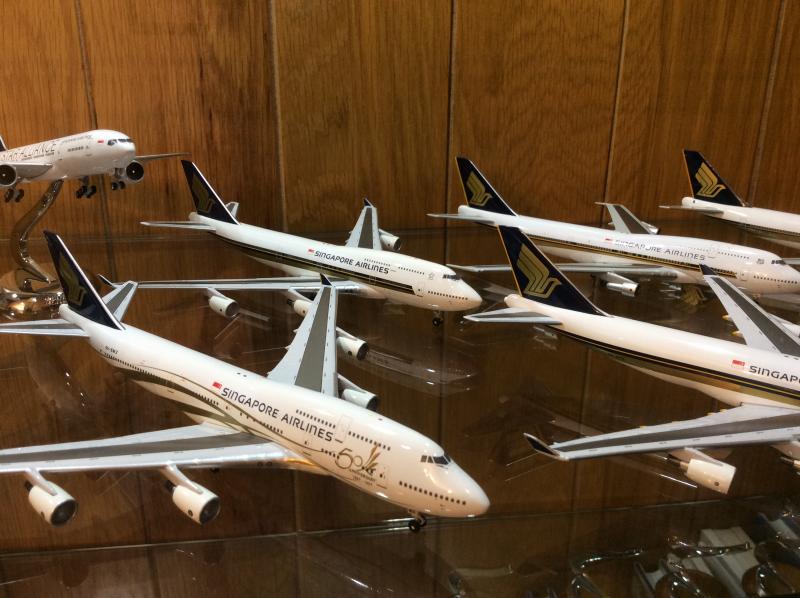
Image resolution: width=800 pixels, height=598 pixels. Find the location of `glass shelf`. glass shelf is located at coordinates (298, 514).